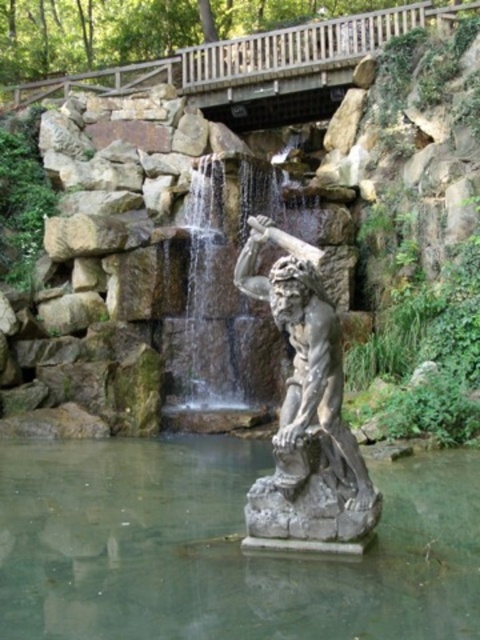
You are a hiker who wants to cross the clear stone water at center to reach the other side. There is a clear stone waterfall at center nearby. Which direction should you go relative to the waterfall to avoid getting wet?

To avoid getting wet, you should go to the right side of the clear stone waterfall at center, where the clear stone water at center is located, since the water flows downward from the waterfall and the right side of the waterfall would be the calmer area.